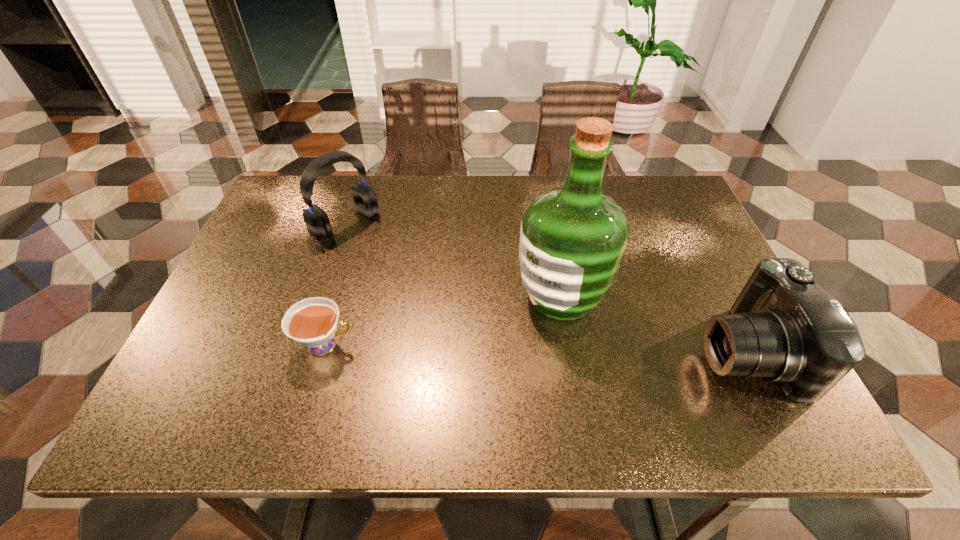
The width and height of the screenshot is (960, 540). I want to click on vacant point that satisfies the following two spatial constraints: 1. on the front side of the teacup; 2. on the side of the second tallest object with the handle, so click(x=306, y=345).